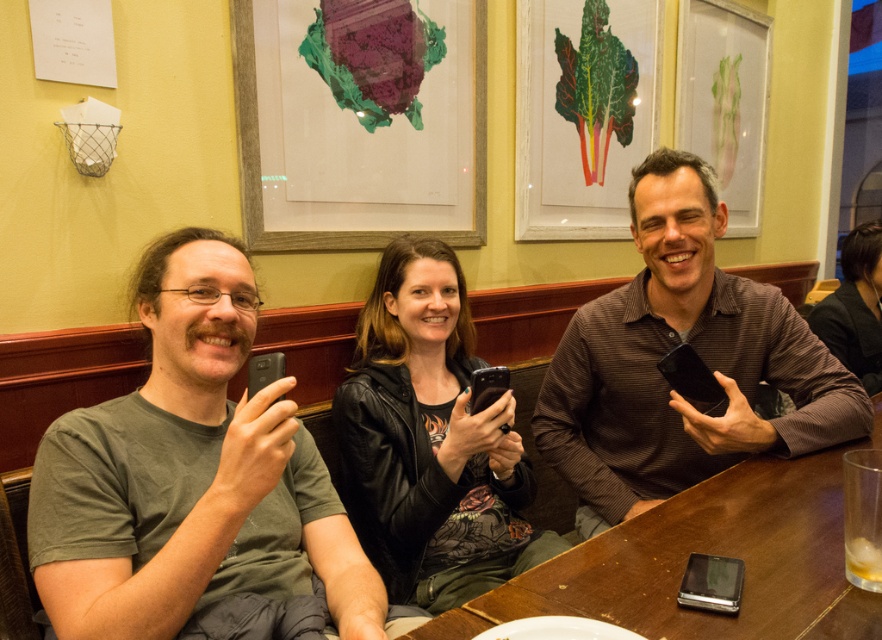
Question: Does green matte shirt at left have a smaller size compared to black leather jacket at upper right?

Choices:
 (A) yes
 (B) no

Answer: (B)

Question: Does black leather jacket at center have a lesser width compared to brown wooden table at center?

Choices:
 (A) yes
 (B) no

Answer: (A)

Question: Can you confirm if green matte shirt at left is positioned to the left of black leather jacket at upper right?

Choices:
 (A) yes
 (B) no

Answer: (A)

Question: Which object is farther from the camera taking this photo?

Choices:
 (A) brown striped shirt at center
 (B) black leather jacket at upper right
 (C) black leather jacket at center

Answer: (B)

Question: Based on their relative distances, which object is farther from the black leather jacket at center?

Choices:
 (A) brown striped shirt at center
 (B) brown wooden table at center

Answer: (B)

Question: Which point is farther from the camera taking this photo?

Choices:
 (A) (873, 316)
 (B) (333, 532)
 (C) (406, 528)
 (D) (676, 298)

Answer: (A)